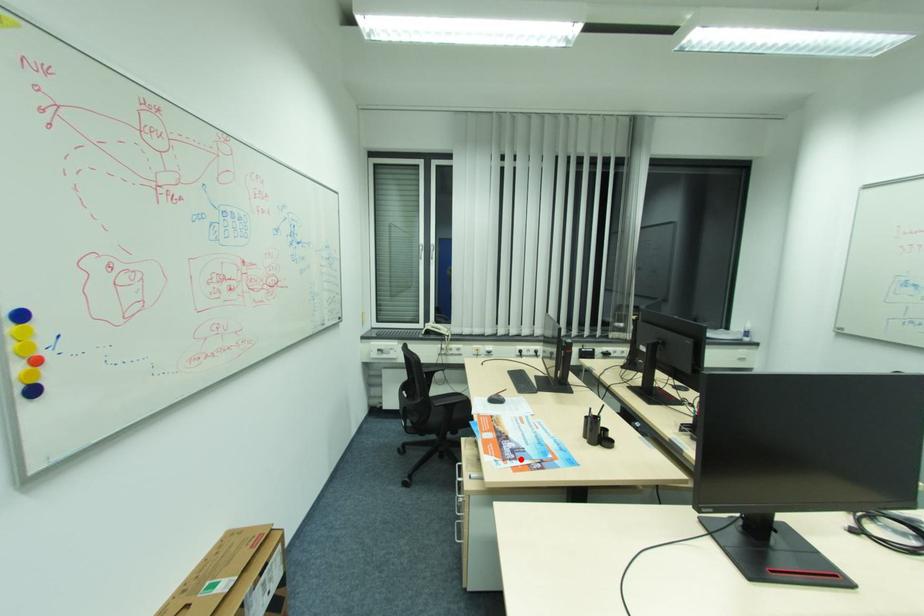
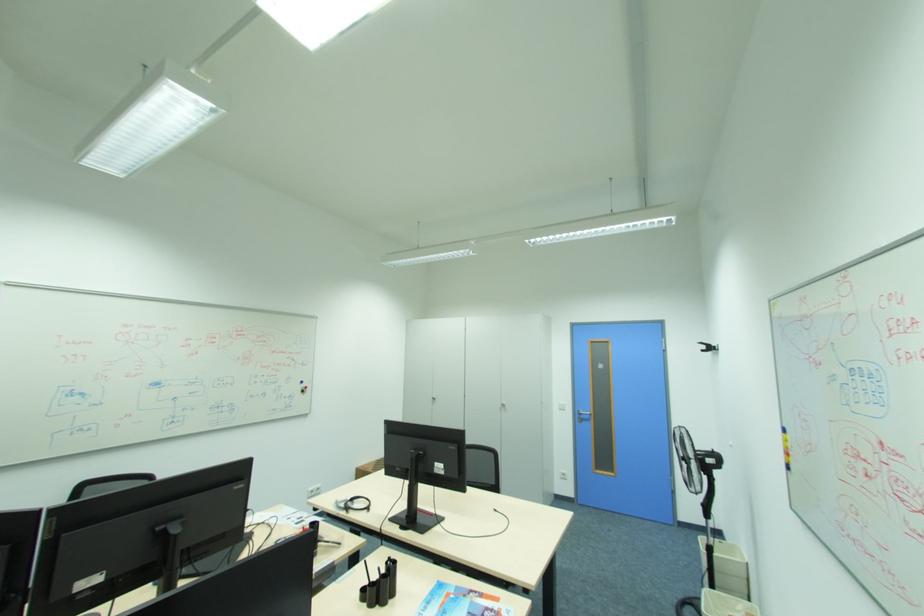
Where in the second image is the point corresponding to the highlighted location from the first image?

(492, 610)